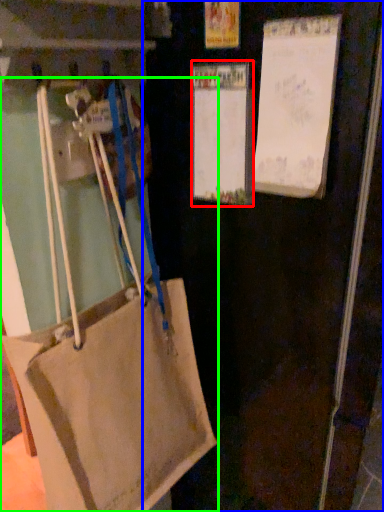
Question: Which object is positioned farthest from bulletin board (highlighted by a red box)? Select from door (highlighted by a blue box) and handbag (highlighted by a green box).

Choices:
 (A) door
 (B) handbag

Answer: (B)